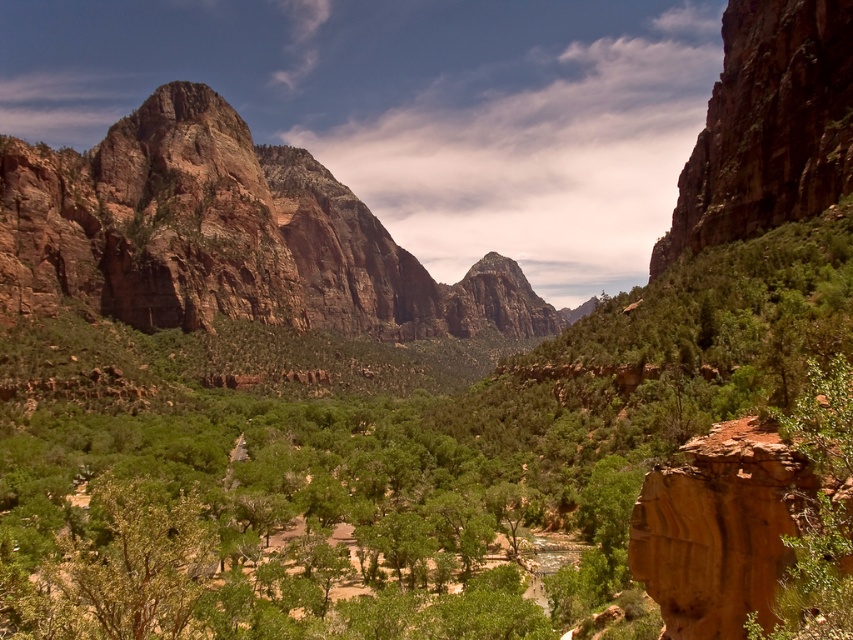
Question: Which point is closer to the camera?

Choices:
 (A) green leafy tree at right
 (B) rustic rock formation at upper left

Answer: (A)

Question: Which point appears farthest from the camera in this image?

Choices:
 (A) (839, 422)
 (B) (132, 176)

Answer: (B)

Question: Where is rustic rock formation at upper left located in relation to green leafy tree at right in the image?

Choices:
 (A) below
 (B) above

Answer: (B)

Question: Is rustic rock formation at upper left below green leafy tree at right?

Choices:
 (A) no
 (B) yes

Answer: (A)

Question: Considering the relative positions of rustic rock formation at upper left and green leafy tree at right in the image provided, where is rustic rock formation at upper left located with respect to green leafy tree at right?

Choices:
 (A) above
 (B) below

Answer: (A)